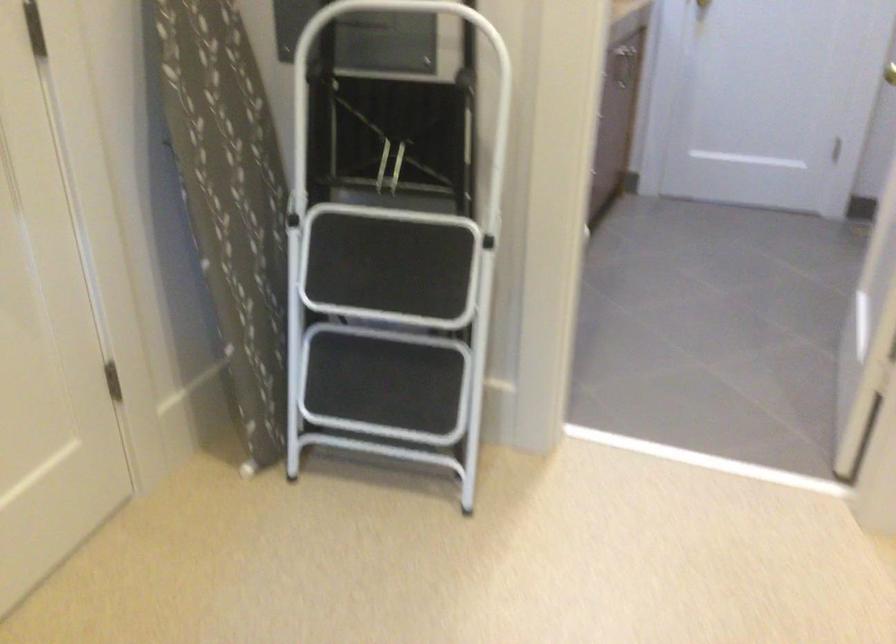
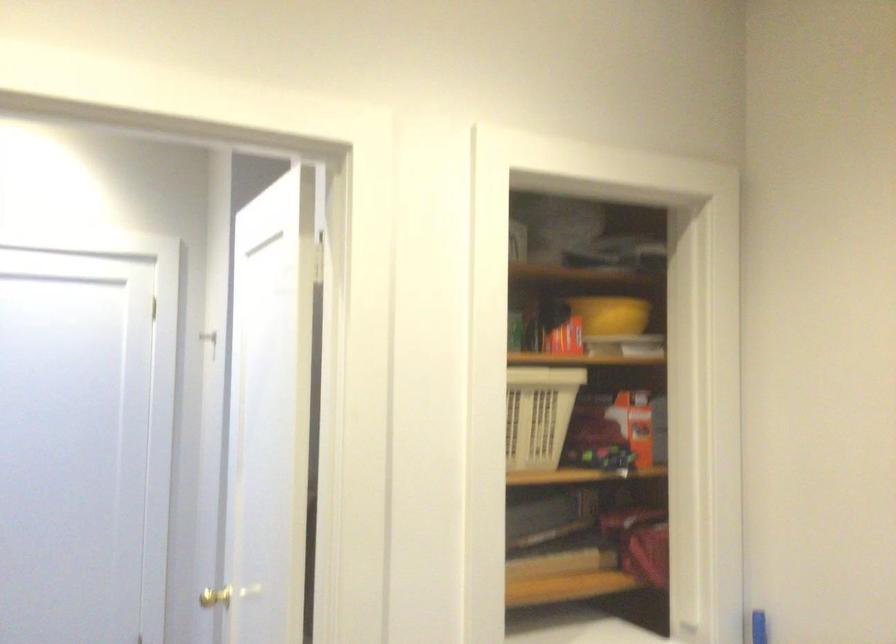
The first image is from the beginning of the video and the second image is from the end. How did the camera likely rotate when shooting the video?

The camera rotated toward right-up.